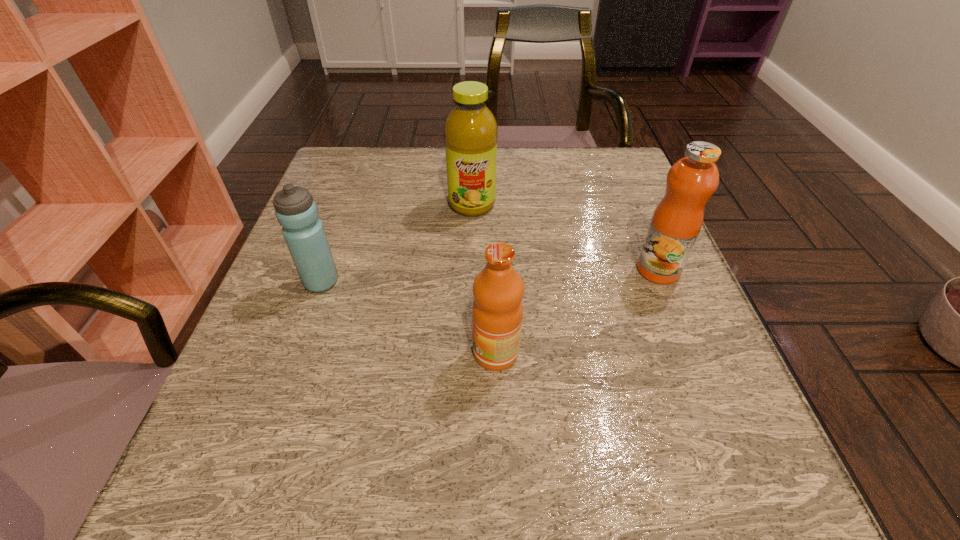
This screenshot has height=540, width=960. In the image, there is a desktop. What are the coordinates of `vacant space at the far right corner` in the screenshot? It's located at (583, 187).

Image resolution: width=960 pixels, height=540 pixels. I want to click on vacant space that's between the water bottle and the nearest object, so 409,318.

Image resolution: width=960 pixels, height=540 pixels. Find the location of `vacant area that lies between the rightmost object and the shortest fruit juice`. vacant area that lies between the rightmost object and the shortest fruit juice is located at coordinates (577, 312).

Where is `vacant area that lies between the nearest object and the leftmost object`? vacant area that lies between the nearest object and the leftmost object is located at coordinates click(409, 318).

You are a GUI agent. You are given a task and a screenshot of the screen. Output one action in this format:
    pyautogui.click(x=<x>, y=<y>)
    Task: Click on the vacant point located between the rightmost fruit juice and the shortest fruit juice
    This screenshot has width=960, height=540.
    Given the screenshot: What is the action you would take?
    pyautogui.click(x=577, y=312)

You are a GUI agent. You are given a task and a screenshot of the screen. Output one action in this format:
    pyautogui.click(x=<x>, y=<y>)
    Task: Click on the vacant area between the second nearest fruit juice and the farthest fruit juice
    The height and width of the screenshot is (540, 960).
    Given the screenshot: What is the action you would take?
    pyautogui.click(x=565, y=237)

Identify the location of object that ranks as the closest to the second nearest fruit juice. (498, 290).

Point out which object is positioned as the third nearest to the nearest object. Please provide its 2D coordinates. Your answer should be formatted as a tuple, i.e. [(x, y)], where the tuple contains the x and y coordinates of a point satisfying the conditions above.

[(470, 131)]

Image resolution: width=960 pixels, height=540 pixels. What are the coordinates of `the second closest fruit juice to the rightmost fruit juice` in the screenshot? It's located at pos(470,131).

Identify the location of fruit juice that stands as the closest to the farthest fruit juice. (677, 220).